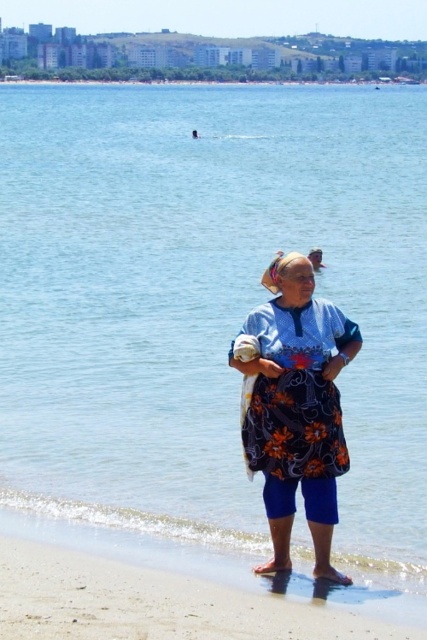
Question: Which point is closer to the camera?

Choices:
 (A) floral fabric apron at center
 (B) floral-patterned fabric dress at center
 (C) sandy beach at lower center

Answer: (C)

Question: Is floral-patterned fabric dress at center closer to the viewer compared to floral fabric apron at center?

Choices:
 (A) no
 (B) yes

Answer: (B)

Question: Can you confirm if sandy beach at lower center is wider than floral fabric apron at center?

Choices:
 (A) no
 (B) yes

Answer: (B)

Question: Which of the following is the farthest from the observer?

Choices:
 (A) sandy beach at lower center
 (B) floral fabric apron at center

Answer: (B)

Question: Is floral-patterned fabric dress at center positioned at the back of floral fabric apron at center?

Choices:
 (A) no
 (B) yes

Answer: (A)

Question: Which point is farther to the camera?

Choices:
 (A) floral fabric apron at center
 (B) floral-patterned fabric dress at center

Answer: (A)